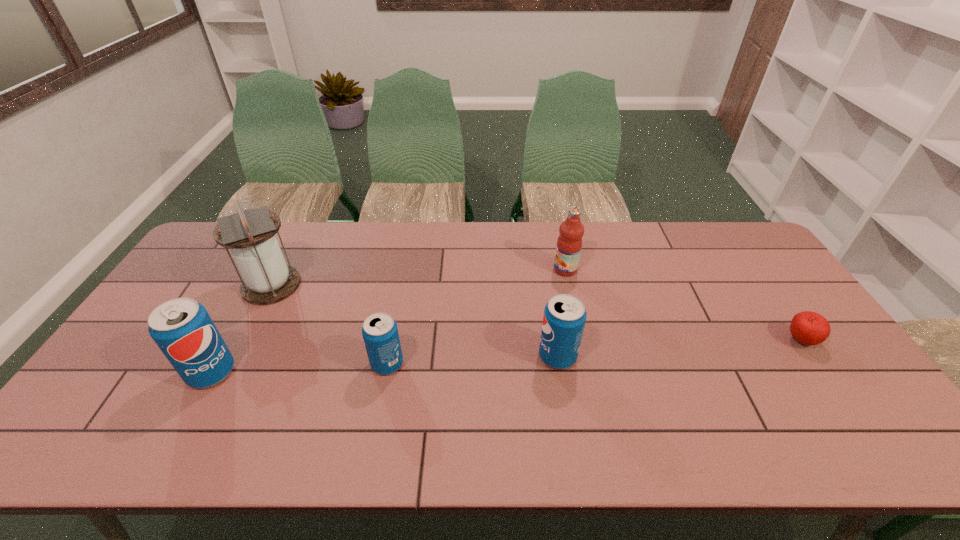
Locate an element on the screen. free space at the far edge is located at coordinates pos(354,223).

Where is `vacant space at the near edge of the desktop`? This screenshot has height=540, width=960. vacant space at the near edge of the desktop is located at coordinates (228, 386).

Image resolution: width=960 pixels, height=540 pixels. Identify the location of free space at the left edge of the desktop. (113, 373).

Where is `vacant space at the right edge of the desktop`? The width and height of the screenshot is (960, 540). vacant space at the right edge of the desktop is located at coordinates (743, 293).

Locate an element on the screen. Image resolution: width=960 pixels, height=540 pixels. vacant space at the near right corner is located at coordinates (862, 406).

What are the coordinates of `vacant space that is in between the second soda can from right to left and the fruit juice` in the screenshot? It's located at (476, 317).

I want to click on free space between the rightmost soda can and the shortest soda can, so click(x=472, y=360).

Where is `free space between the fruit juice and the shortest object`? free space between the fruit juice and the shortest object is located at coordinates (683, 305).

This screenshot has width=960, height=540. I want to click on vacant area that lies between the rightmost soda can and the shortest object, so click(x=679, y=348).

Locate an element on the screen. The height and width of the screenshot is (540, 960). blank region between the shortest object and the third shortest object is located at coordinates (679, 348).